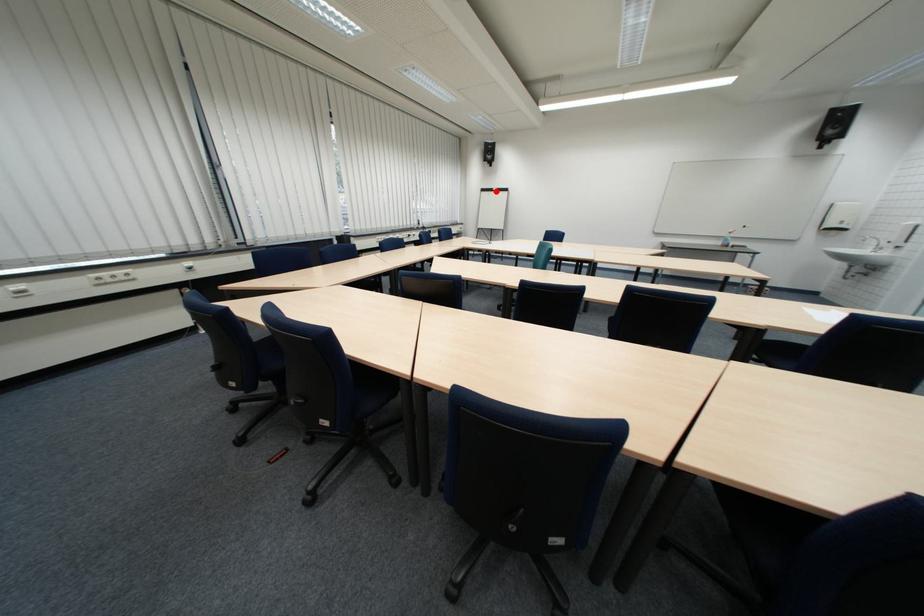
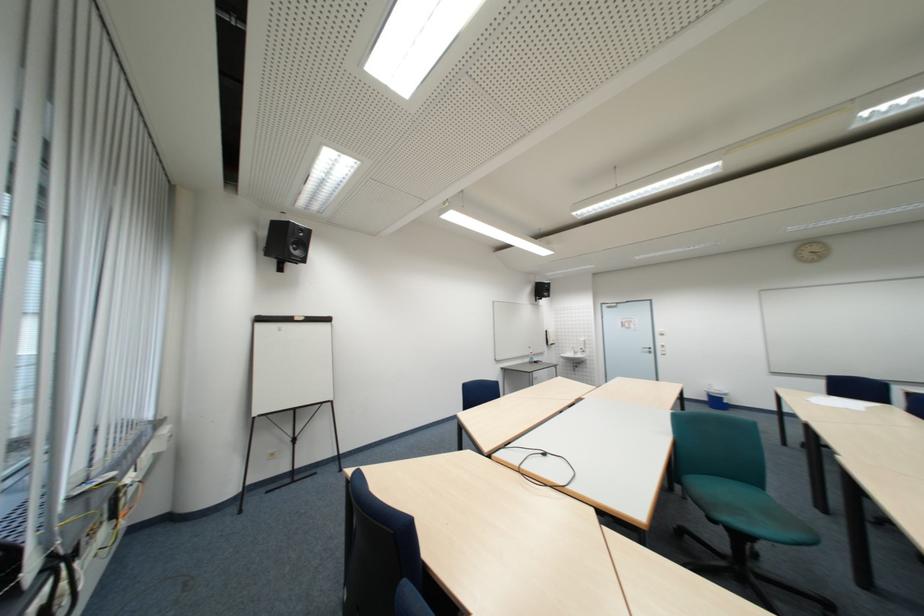
Question: I am providing you with two images of the same scene from different viewpoints. Image1 has a red point marked. In image2, the corresponding 3D location appears at what relative position? Reply with the corresponding letter.

Choices:
 (A) Closer
 (B) Farther

Answer: (B)